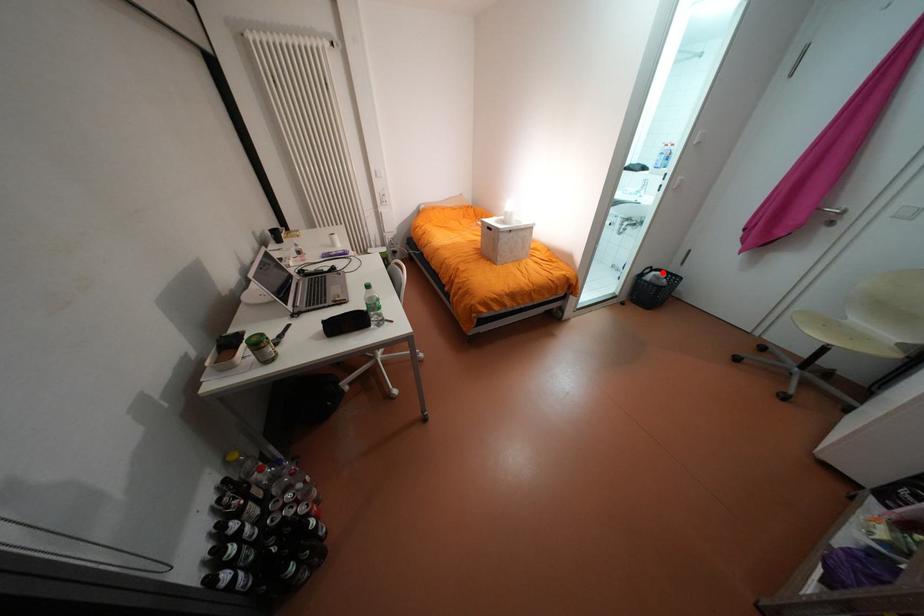
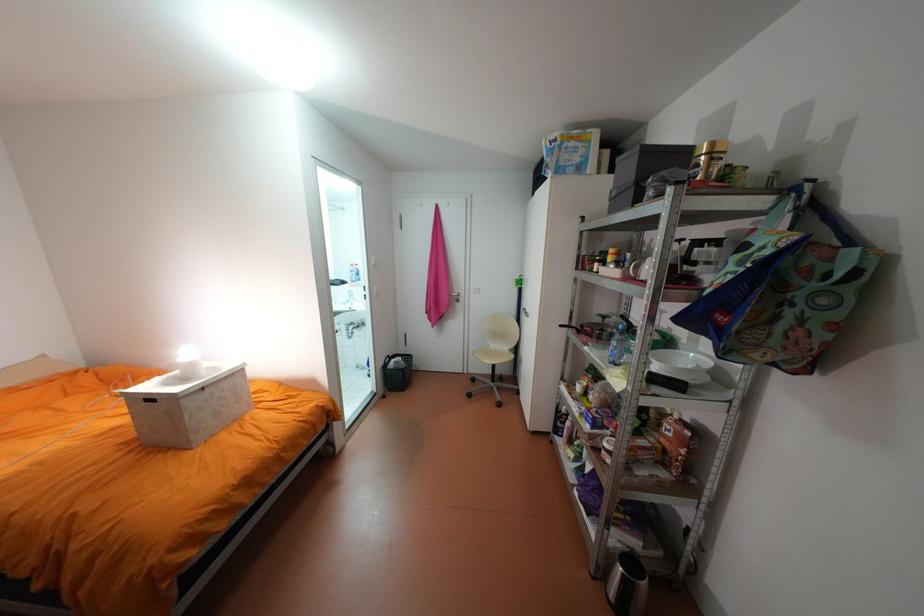
Where in the second image is the point corresponding to the highlighted location from the first image?

(402, 360)